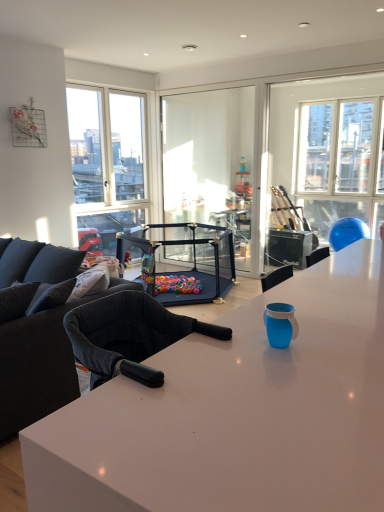
Question: From a real-world perspective, is black plastic playpen at center positioned above or below white glossy desk at center?

Choices:
 (A) above
 (B) below

Answer: (B)

Question: Based on their sizes in the image, would you say black plastic playpen at center is bigger or smaller than white glossy desk at center?

Choices:
 (A) big
 (B) small

Answer: (B)

Question: Which object is the farthest from the black plastic playpen at center?

Choices:
 (A) white glossy desk at center
 (B) transparent glass window at upper right
 (C) black fabric couch at left

Answer: (A)

Question: Which is nearer to the transparent glass window at upper right?

Choices:
 (A) black fabric couch at left
 (B) black plastic playpen at center
 (C) white glossy desk at center

Answer: (B)